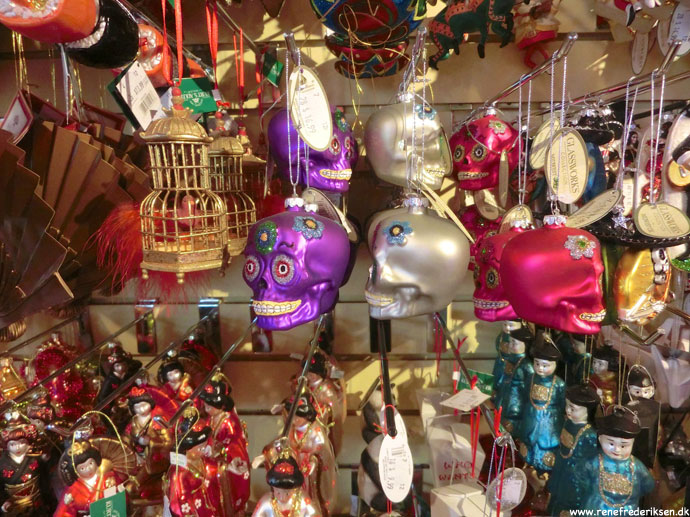
The width and height of the screenshot is (690, 517). I want to click on minature bird cage, so click(179, 225), click(237, 207).